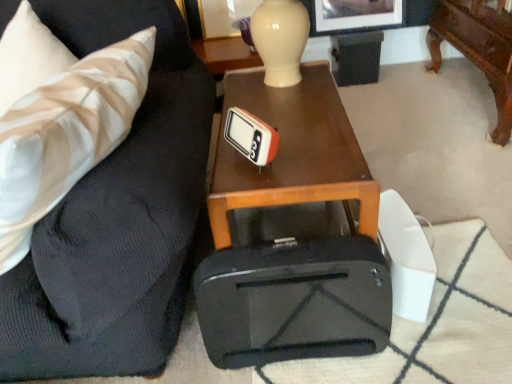
You are a GUI agent. You are given a task and a screenshot of the screen. Output one action in this format:
    pyautogui.click(x=<x>, y=<y>)
    Task: Click on the matte black suitcase at lower right
    
    Given the screenshot: What is the action you would take?
    pyautogui.click(x=116, y=217)

Measure the distance between point (153, 85) and camera.

The distance of point (153, 85) from camera is 3.87 feet.

This screenshot has width=512, height=384. What do you see at coordinates (294, 301) in the screenshot?
I see `black matte suitcase at center` at bounding box center [294, 301].

The height and width of the screenshot is (384, 512). What do you see at coordinates (353, 15) in the screenshot?
I see `matte black picture frame at upper center, the 2th picture frame from the left` at bounding box center [353, 15].

Image resolution: width=512 pixels, height=384 pixels. Describe the element at coordinates (224, 16) in the screenshot. I see `matte white picture frame at upper center, acting as the 2th picture frame starting from the right` at that location.

Locate an element on the screen. This screenshot has width=512, height=384. woodenobject at center is located at coordinates (291, 151).

Where is `white striped fabric pillow at left`? This screenshot has width=512, height=384. white striped fabric pillow at left is located at coordinates (66, 134).

You are a GUI agent. You are given a task and a screenshot of the screen. Output one action in this format:
    pyautogui.click(x=<x>, y=<y>)
    Task: Click on the picture frame that is the 1st one above the black matte suitcase at center (from a real-world perspective)
    The image size is (512, 384).
    Given the screenshot: What is the action you would take?
    pyautogui.click(x=353, y=15)

Can you tell me how much matte black picture frame at upper center, which is the 1th picture frame in right-to-left order, and black matte suitcase at center differ in facing direction?

The facing directions of matte black picture frame at upper center, which is the 1th picture frame in right-to-left order, and black matte suitcase at center are 0.132 degrees apart.

Is matte black picture frame at upper center, the 2th picture frame from the left, positioned beyond the bounds of black matte suitcase at center?

That's correct, matte black picture frame at upper center, the 2th picture frame from the left, is outside of black matte suitcase at center.

From the image's perspective, is matte black picture frame at upper center, the 2th picture frame from the left, below black matte suitcase at center?

No.

At what (x,y) coordinates should I click in order to perform the action: click on the 2nd picture frame to the right of the white striped fabric pillow at left, counting from the anchor's position. Please return your answer as a coordinate pair (x, y). Looking at the image, I should click on [353, 15].

Is white striped fabric pillow at left oriented towards matte black picture frame at upper center, the 2th picture frame from the left?

No, white striped fabric pillow at left does not turn towards matte black picture frame at upper center, the 2th picture frame from the left.

Could matte black picture frame at upper center, the 2th picture frame from the left, be considered to be inside white striped fabric pillow at left?

No, matte black picture frame at upper center, the 2th picture frame from the left, is not a part of white striped fabric pillow at left.

Does black matte suitcase at center contain matte white picture frame at upper center, which appears as the first picture frame when viewed from the left?

No.

Does black matte suitcase at center come in front of matte white picture frame at upper center, which appears as the first picture frame when viewed from the left?

Yes.

From a real-world perspective, between black matte suitcase at center and matte white picture frame at upper center, which appears as the first picture frame when viewed from the left, who is vertically higher?

In real-world perspective, matte white picture frame at upper center, which appears as the first picture frame when viewed from the left, is above.

Is black matte suitcase at center smaller than matte white picture frame at upper center, acting as the 2th picture frame starting from the right?

No, black matte suitcase at center is not smaller than matte white picture frame at upper center, acting as the 2th picture frame starting from the right.

Considering the positions of objects matte black suitcase at lower right and black matte suitcase at center in the image provided, who is more to the left, matte black suitcase at lower right or black matte suitcase at center?

matte black suitcase at lower right.

Considering the sizes of objects matte black suitcase at lower right and black matte suitcase at center in the image provided, who is bigger, matte black suitcase at lower right or black matte suitcase at center?

With larger size is matte black suitcase at lower right.

Are matte black suitcase at lower right and black matte suitcase at center located far from each other?

No, matte black suitcase at lower right is not far from black matte suitcase at center.

Considering the sizes of objects matte black suitcase at lower right and black matte suitcase at center in the image provided, who is shorter, matte black suitcase at lower right or black matte suitcase at center?

black matte suitcase at center.

Is black matte suitcase at center located outside matte black suitcase at lower right?

Yes.

Does point (328, 276) lie in front of point (130, 285)?

No, it is not.

Is black matte suitcase at center placed right next to matte black suitcase at lower right?

No, black matte suitcase at center is not making contact with matte black suitcase at lower right.

Which object is closer to the camera, black matte suitcase at center or matte black suitcase at lower right?

matte black suitcase at lower right is closer to the camera.

Is white plastic thermometer at center far from matte black suitcase at lower right?

white plastic thermometer at center is actually quite close to matte black suitcase at lower right.

Between white plastic thermometer at center and matte black suitcase at lower right, which one has less height?

white plastic thermometer at center is shorter.

Who is smaller, white plastic thermometer at center or matte black suitcase at lower right?

white plastic thermometer at center is smaller.

Where is `furniture above the woodenobject at center (from a real-world perspective)`? Image resolution: width=512 pixels, height=384 pixels. furniture above the woodenobject at center (from a real-world perspective) is located at coordinates (116, 217).

Does matte black suitcase at lower right turn towards woodenobject at center?

No, matte black suitcase at lower right is not turned towards woodenobject at center.

Does point (113, 354) come behind point (332, 77)?

No.

Locate an element on the screen. picture frame that is the 1st object located behind the black matte suitcase at center is located at coordinates (353, 15).

You are a GUI agent. You are given a task and a screenshot of the screen. Output one action in this format:
    pyautogui.click(x=<x>, y=<y>)
    Task: Click on the throw pillow above the matte black picture frame at upper center, which is the 1th picture frame in right-to-left order (from a real-world perspective)
    
    Given the screenshot: What is the action you would take?
    pyautogui.click(x=66, y=134)

Based on their spatial positions, is white plastic thermometer at center or black matte suitcase at center closer to matte black suitcase at lower right?

white plastic thermometer at center is closer to matte black suitcase at lower right.

Estimate the real-world distances between objects in this image. Which object is closer to white plastic thermometer at center, matte black suitcase at lower right or woodenobject at center?

The object closer to white plastic thermometer at center is woodenobject at center.

Looking at the image, which one is located further to woodenobject at center, matte black suitcase at lower right or black matte suitcase at center?

Among the two, black matte suitcase at center is located further to woodenobject at center.

Estimate the real-world distances between objects in this image. Which object is further from black matte suitcase at center, matte white picture frame at upper center, acting as the 2th picture frame starting from the right, or white plastic thermometer at center?

Among the two, matte white picture frame at upper center, acting as the 2th picture frame starting from the right, is located further to black matte suitcase at center.

From the image, which object appears to be farther from matte white picture frame at upper center, which appears as the first picture frame when viewed from the left, black matte suitcase at center or matte black picture frame at upper center, which is the 1th picture frame in right-to-left order?

Among the two, black matte suitcase at center is located further to matte white picture frame at upper center, which appears as the first picture frame when viewed from the left.

From the picture: From the image, which object appears to be nearer to matte black suitcase at lower right, matte black picture frame at upper center, which is the 1th picture frame in right-to-left order, or matte white picture frame at upper center, which appears as the first picture frame when viewed from the left?

matte white picture frame at upper center, which appears as the first picture frame when viewed from the left.

Looking at the image, which one is located further to black matte suitcase at center, woodenobject at center or matte black suitcase at lower right?

matte black suitcase at lower right lies further to black matte suitcase at center than the other object.

When comparing their distances from matte black suitcase at lower right, does white striped fabric pillow at left or matte white picture frame at upper center, acting as the 2th picture frame starting from the right, seem further?

matte white picture frame at upper center, acting as the 2th picture frame starting from the right, is positioned further to the anchor matte black suitcase at lower right.

You are a GUI agent. You are given a task and a screenshot of the screen. Output one action in this format:
    pyautogui.click(x=<x>, y=<y>)
    Task: Click on the table between black matte suitcase at center and matte white picture frame at upper center, acting as the 2th picture frame starting from the right, along the z-axis
    
    Given the screenshot: What is the action you would take?
    pyautogui.click(x=291, y=151)

The image size is (512, 384). I want to click on thermometer between white striped fabric pillow at left and black matte suitcase at center from left to right, so click(x=251, y=136).

You are a GUI agent. You are given a task and a screenshot of the screen. Output one action in this format:
    pyautogui.click(x=<x>, y=<y>)
    Task: Click on the table between matte black suitcase at lower right and matte black picture frame at upper center, which is the 1th picture frame in right-to-left order, along the z-axis
    This screenshot has height=384, width=512.
    Given the screenshot: What is the action you would take?
    pyautogui.click(x=291, y=151)

This screenshot has height=384, width=512. In order to click on thermometer located between white striped fabric pillow at left and matte white picture frame at upper center, which appears as the first picture frame when viewed from the left, in the depth direction in this screenshot , I will do `click(251, 136)`.